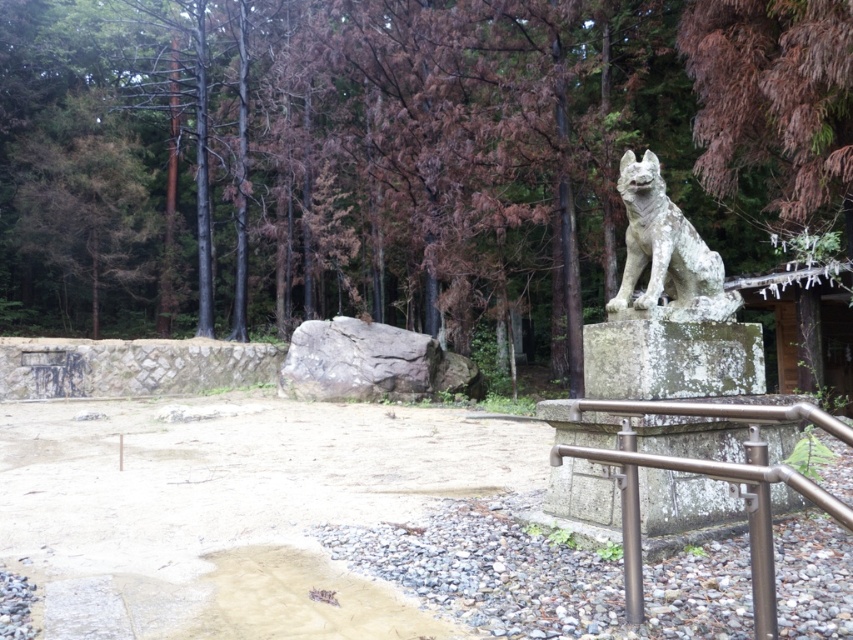
You are a hiker who wants to place a small backpack between the green textured rock at center and the white stone statue at upper right. Considering their sizes, which object should you place the backpack next to to ensure it doesn

The green textured rock at center is bigger than the white stone statue at upper right. Therefore, placing the backpack next to the green textured rock at center would provide more space and stability.

You are a tour guide leading a group through a memorial garden. You need to ensure that visitors can safely walk between the satin silver railing at lower right and the white stone statue at upper right. Given that the minimum safe distance for a walkway is 1.5 meters, is the current spacing between these two objects sufficient?

The satin silver railing at lower right and the white stone statue at upper right are 1.43 meters apart, which is less than the required 1.5 meters for a safe walkway. Therefore, the current spacing is insufficient.

You are standing at the center of the image and want to place a small flower pot at point (398, 156). However, there is an object already there. What is the object located at that coordinate?

The object located at point (398, 156) is a green textured rock at center.